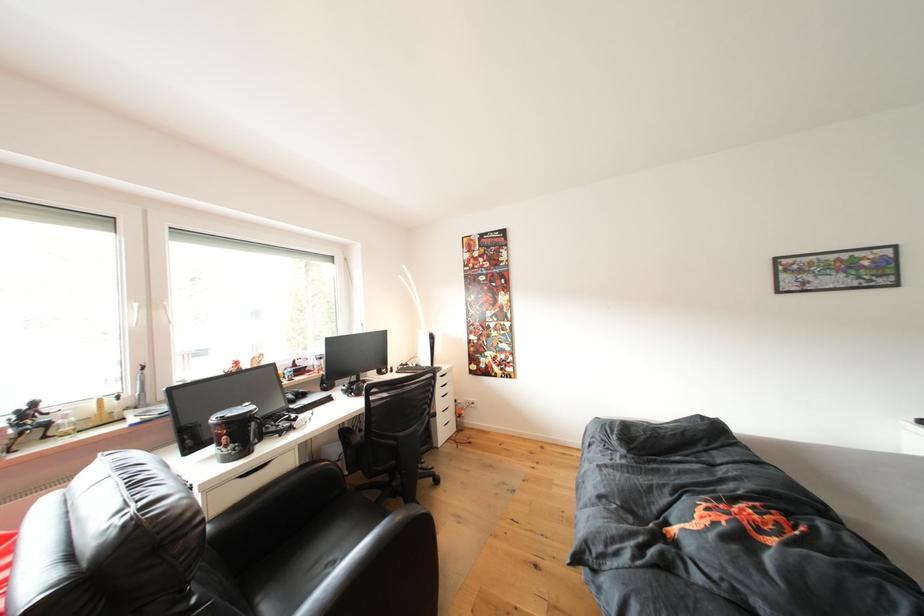
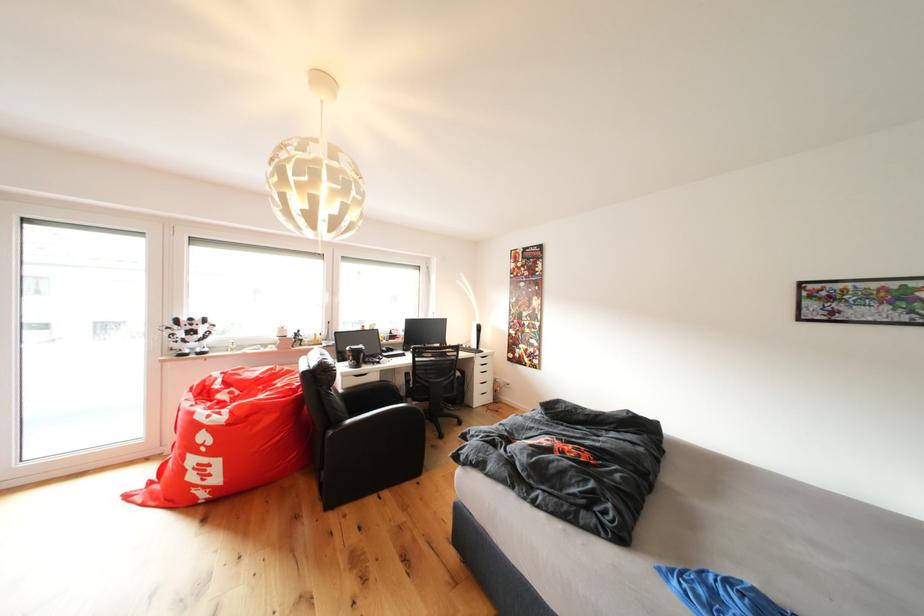
Locate, in the second image, the point that corresponds to (447,387) in the first image.

(487, 366)